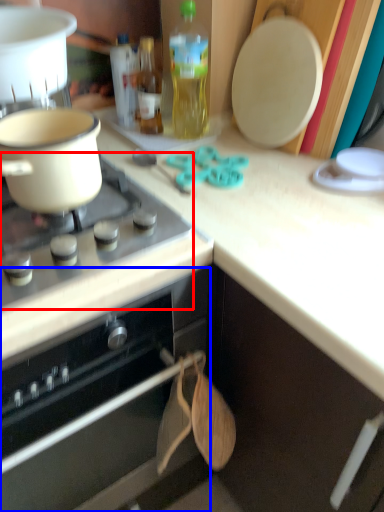
Question: Which of the following is the farthest to the observer, gas stove (highlighted by a red box) or oven (highlighted by a blue box)?

Choices:
 (A) gas stove
 (B) oven

Answer: (A)